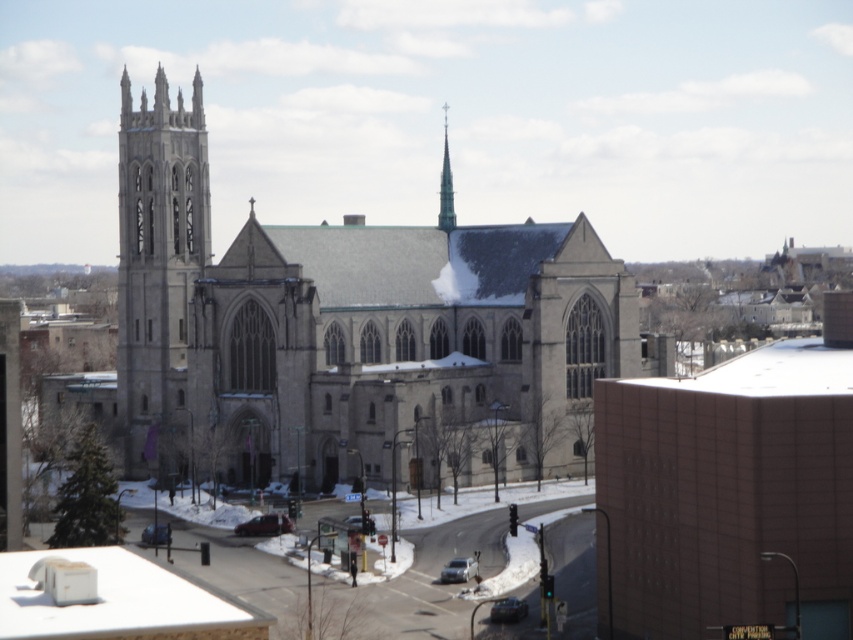
You are a city planner assessing the space between the gray stone tower at left and the green glass spire at upper center. Given that the minimum required distance for safety regulations is 20 meters, does the current spacing meet the requirement?

The gray stone tower at left and green glass spire at upper center are 22.02 meters apart, which exceeds the 20 meters minimum requirement, so yes, the current spacing meets the safety regulations.

You are a tourist standing on the street in front of the church. You notice the gray stone tower at left and the green glass spire at upper center. Which of these two structures is larger in size?

The gray stone tower at left is bigger than the green glass spire at upper center.

You are a tourist standing on the street in front of the gray stone church at center. You want to take a photo of the green glass spire at upper center without the church blocking it. Is it possible to do so based on their positions?

The gray stone church at center is in front of the green glass spire at upper center, so it will block the view. You cannot take a photo of the green glass spire at upper center without the church blocking it.